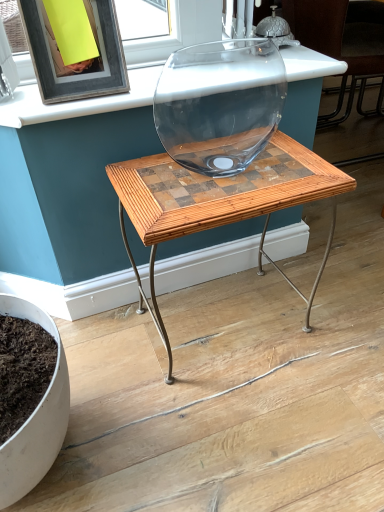
In order to click on empty space that is to the right of wooden mosaic table at center in this screenshot , I will do `click(340, 307)`.